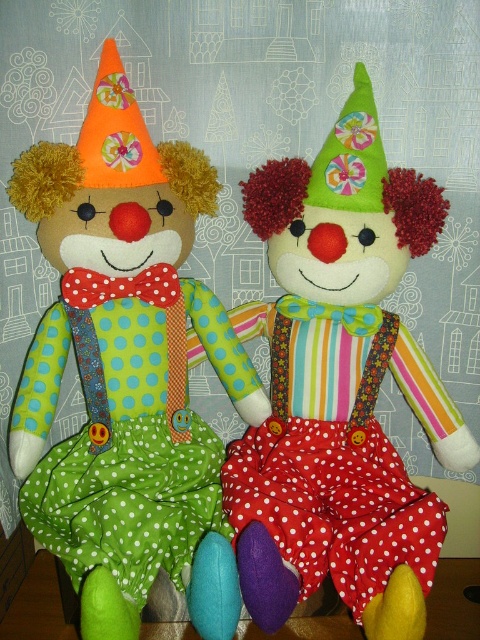
You are standing 5 feet away from the backdrop with the whimsical houses and trees. You want to take a photo of the matte fabric clown at left without it being blurry. Since the camera can only focus on objects within 3 feet, will the clown be in focus?

The matte fabric clown at left is 30.94 inches away from camera. Since 30.94 inches is approximately 2.58 feet, which is within the 3 feet focus range, the clown will be in focus.

You are an interior designer arranging these clowns on a shelf. The shelf has limited space. Which clown, the matte fabric clown at left or the matte green fabric clown at center, should you place first to ensure they both fit?

The matte fabric clown at left has a lesser width compared to the matte green fabric clown at center, so you should place the larger matte green fabric clown at center first to ensure both fit on the shelf.